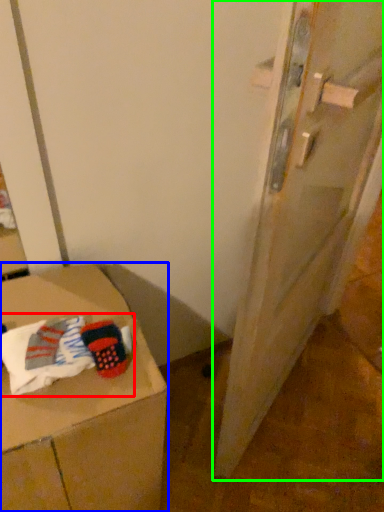
Question: Estimate the real-world distances between objects in this image. Which object is closer to laundry (highlighted by a red box), furniture (highlighted by a blue box) or door (highlighted by a green box)?

Choices:
 (A) furniture
 (B) door

Answer: (A)